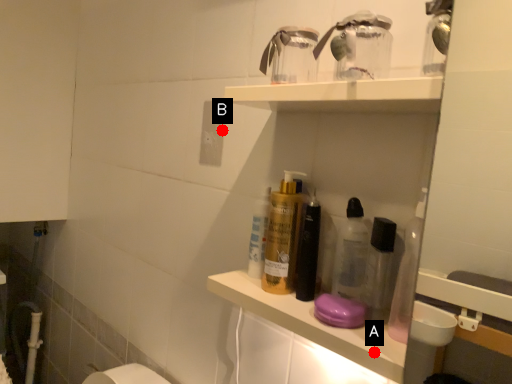
Question: Two points are circled on the image, labeled by A and B beside each circle. Which point is closer to the camera?

Choices:
 (A) A is closer
 (B) B is closer

Answer: (A)